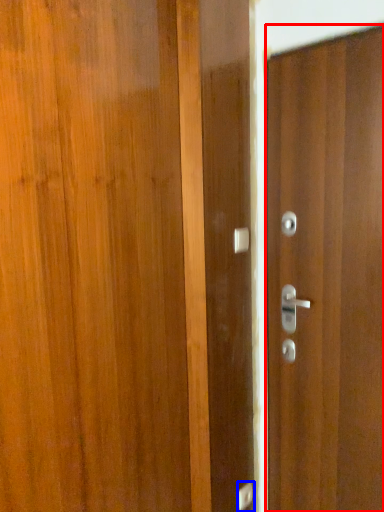
Question: Which of the following is the closest to the observer, door (highlighted by a red box) or door handle (highlighted by a blue box)?

Choices:
 (A) door
 (B) door handle

Answer: (A)